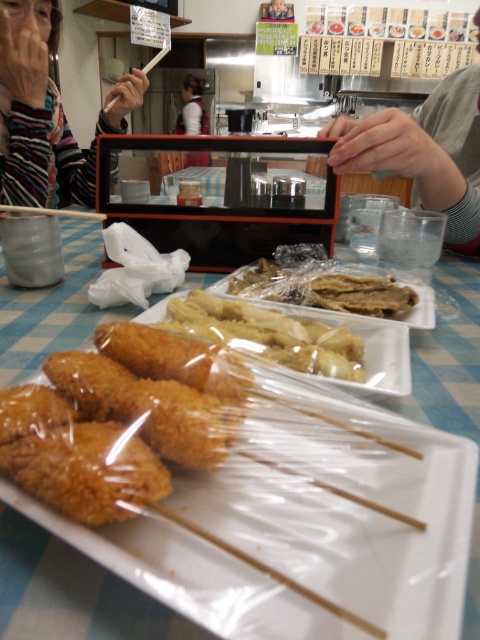
Who is more forward, (1, 445) or (84, 212)?

Point (1, 445)

Locate an element on the screen. golden crispy skewers at center is located at coordinates (119, 419).

Is golden crispy skewers at center wider than golden crispy chicken at center?

Incorrect, golden crispy skewers at center's width does not surpass golden crispy chicken at center's.

Between golden crispy skewers at center and golden crispy chicken at center, which one has more height?

With more height is golden crispy skewers at center.

The height and width of the screenshot is (640, 480). Describe the element at coordinates (119, 419) in the screenshot. I see `golden crispy skewers at center` at that location.

At what (x,y) coordinates should I click in order to perform the action: click on golden crispy skewers at center. Please return your answer as a coordinate pair (x, y). The width and height of the screenshot is (480, 640). Looking at the image, I should click on (119, 419).

Who is higher up, transparent plastic chopstick at center or white shirt at center?

white shirt at center is above.

Which of these two, transparent plastic chopstick at center or white shirt at center, stands taller?

Standing taller between the two is white shirt at center.

Is point (323, 608) positioned before point (190, 92)?

Yes, it is in front of point (190, 92).

The height and width of the screenshot is (640, 480). Identify the location of transparent plastic chopstick at center. (251, 563).